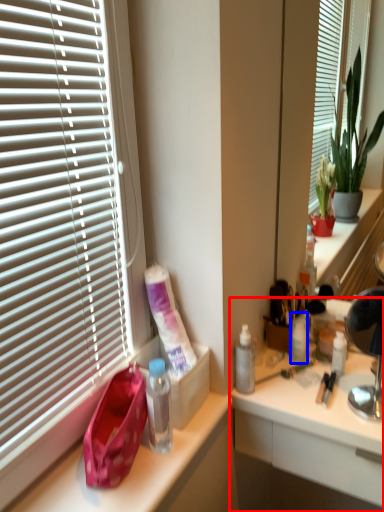
Question: Among these objects, which one is nearest to the camera, desk (highlighted by a red box) or toiletry (highlighted by a blue box)?

Choices:
 (A) desk
 (B) toiletry

Answer: (A)